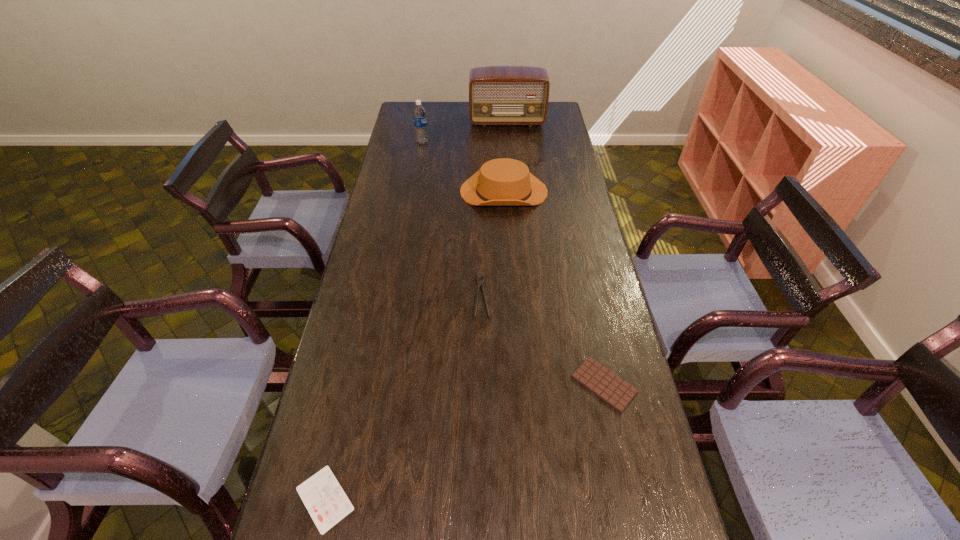
Locate which object ranks fifth in proximity to the third nearest object. Please provide its 2D coordinates. Your answer should be formatted as a tuple, i.e. [(x, y)], where the tuple contains the x and y coordinates of a point satisfying the conditions above.

[(498, 95)]

Where is `blank area in the image that satisfies the following two spatial constraints: 1. on the front-facing side of the radio receiver; 2. on the front-facing side of the cowboy hat`? The width and height of the screenshot is (960, 540). blank area in the image that satisfies the following two spatial constraints: 1. on the front-facing side of the radio receiver; 2. on the front-facing side of the cowboy hat is located at coordinates (513, 191).

Locate an element on the screen. The image size is (960, 540). free region that satisfies the following two spatial constraints: 1. on the back side of the chocolate bar; 2. on the right side of the diary is located at coordinates (351, 384).

Image resolution: width=960 pixels, height=540 pixels. Find the location of `blank area in the image that satisfies the following two spatial constraints: 1. on the front-facing side of the chocolate bar; 2. on the left side of the cowboy hat`. blank area in the image that satisfies the following two spatial constraints: 1. on the front-facing side of the chocolate bar; 2. on the left side of the cowboy hat is located at coordinates (516, 384).

Where is `free space that satisfies the following two spatial constraints: 1. on the front-facing side of the third farthest object; 2. on the back side of the chocolate bar`? free space that satisfies the following two spatial constraints: 1. on the front-facing side of the third farthest object; 2. on the back side of the chocolate bar is located at coordinates pyautogui.click(x=516, y=384).